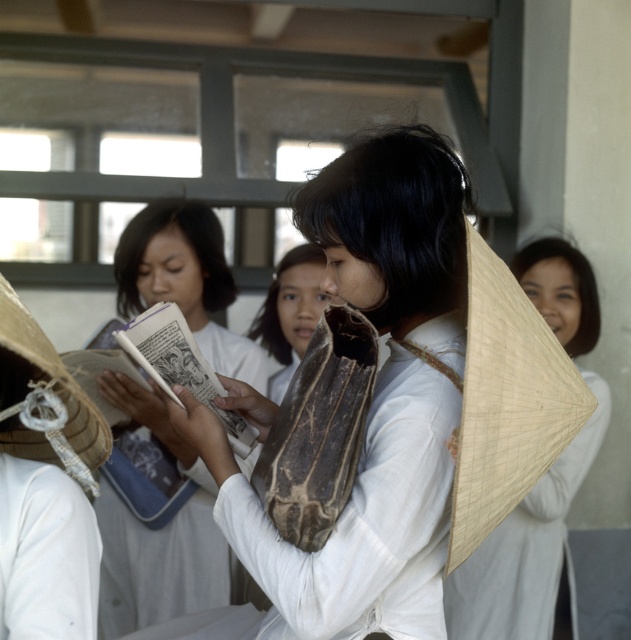
You are a photographer trying to capture both the matte brown bag at center and the natural straw hat at center in a single frame. Based on their heights, which object should you adjust your camera angle to focus on first to ensure both are in the frame?

The matte brown bag at center has a lesser height compared to natural straw hat at center, so you should focus on the natural straw hat at center first to accommodate its taller height in the frame.

You are a photographer adjusting your camera to focus on two points in the image. The first point is point (545, 314) and the second is point (322, 301). Which point is closer to your camera lens?

Point (545, 314) is further to the viewer than point (322, 301). Therefore, point (322, 301) is closer to the camera lens.

In the scene shown: You are a student trying to decide whether to place your matte brown bag at center and white paper book at center on the same shelf. The shelf has limited height space. Based on their sizes, which item might not fit if the shelf has a height restriction?

The matte brown bag at center is much taller than the white paper book at center, so the matte brown bag at center might not fit on the shelf if there is a height restriction.